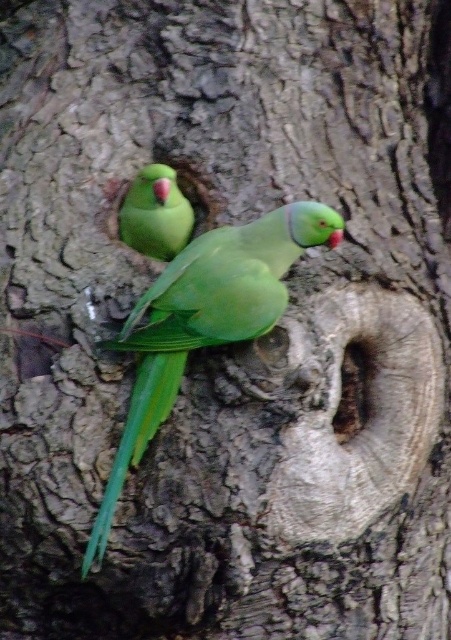
You are a birdwatcher trying to observe both parrots. Which parrot is positioned closer to you, the green matte parrot at center or the green matte parrot at upper left?

The green matte parrot at center is closer to the viewer than the green matte parrot at upper left.

You are observing two green matte parrots in a tree. The parrots are labeled as the green matte parrot at center and the green matte parrot at upper left. Which parrot is positioned more to the right side of the image?

The green matte parrot at center is positioned more to the right side of the image than the green matte parrot at upper left.